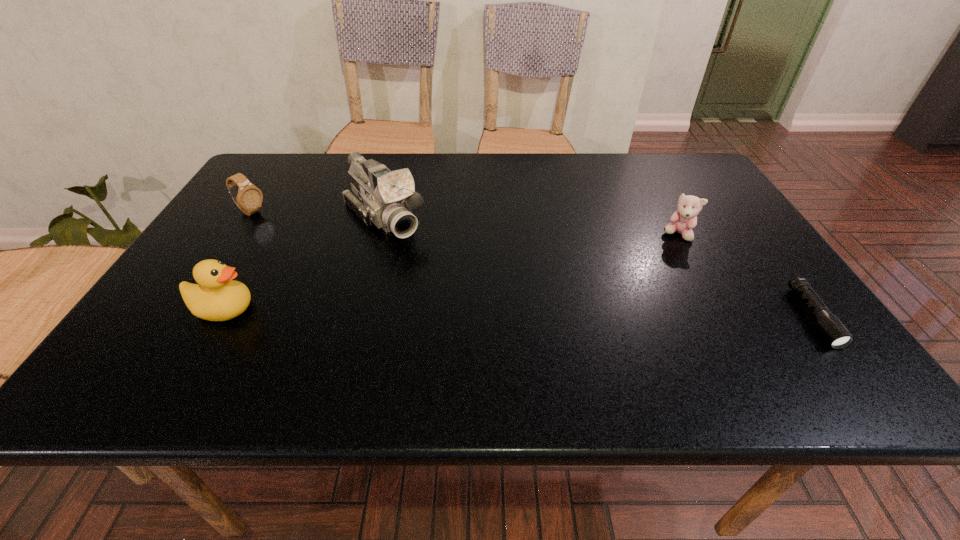
Find the location of a particular element. free space located 0.310m on the face of the watch is located at coordinates (343, 261).

Find the location of a particular element. Image resolution: width=960 pixels, height=540 pixels. vacant area located at the face of the fourth object from left to right is located at coordinates (646, 256).

What are the coordinates of `free region located at the face of the fourth object from left to right` in the screenshot? It's located at (593, 295).

In order to click on vacant space positioned at the face of the fourth object from left to right in this screenshot , I will do `click(636, 264)`.

Image resolution: width=960 pixels, height=540 pixels. I want to click on free region located on the front-facing side of the camcorder, so click(487, 327).

Where is `free space located 0.280m on the front-facing side of the camcorder`? free space located 0.280m on the front-facing side of the camcorder is located at coordinates (469, 309).

Locate an element on the screen. Image resolution: width=960 pixels, height=540 pixels. vacant space positioned 0.260m on the front-facing side of the camcorder is located at coordinates (465, 304).

Identify the location of object positioned at the far edge. The height and width of the screenshot is (540, 960). (385, 198).

I want to click on duck at the near edge, so click(217, 297).

This screenshot has width=960, height=540. I want to click on flashlight that is at the near edge, so click(835, 333).